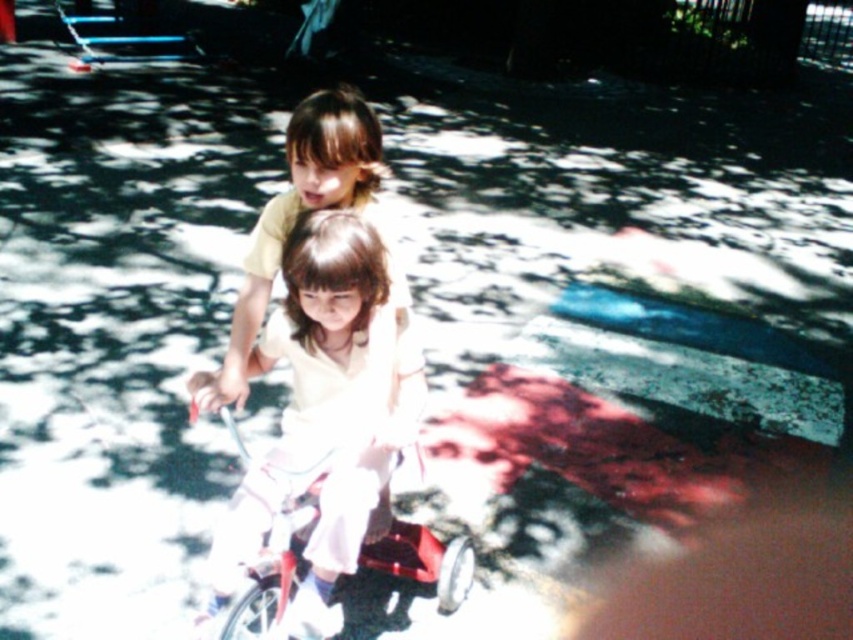
Based on the photo, you are a photographer trying to capture a photo of the matte white shirt at center and the metallic red bicycle at center. Which object should you focus on first if you want to ensure both are in focus without adjusting the camera settings?

The matte white shirt at center is much taller than the metallic red bicycle at center, so focusing on the taller object first would help ensure both are in focus.

You are a photographer trying to capture a clear shot of the matte white shirt at center and the metallic red bicycle at center. Since the shirt is above the bicycle, where should you position your camera to ensure both are in frame?

The matte white shirt at center is located above the metallic red bicycle at center, so position the camera slightly below eye level to capture both the shirt and the bicycle in the frame.